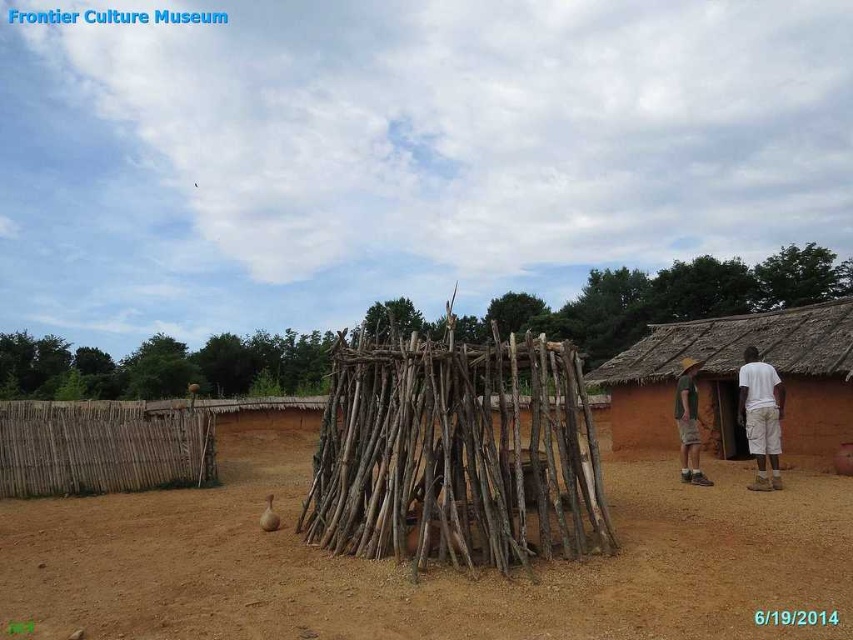
Question: Where is brown dirt field at center located in relation to brown mud hut at right in the image?

Choices:
 (A) left
 (B) right

Answer: (A)

Question: Does brown mud hut at right lie behind tan fabric shorts at lower right?

Choices:
 (A) no
 (B) yes

Answer: (A)

Question: Which point is farther from the camera taking this photo?

Choices:
 (A) (619, 438)
 (B) (769, 506)
 (C) (680, 448)
 (D) (773, 371)

Answer: (A)

Question: Which point is farther from the camera taking this photo?

Choices:
 (A) (212, 604)
 (B) (674, 404)
 (C) (824, 420)
 (D) (758, 400)

Answer: (B)

Question: Which of the following is the farthest from the observer?

Choices:
 (A) white cotton shirt at right
 (B) tan fabric shorts at lower right
 (C) brown dirt field at center

Answer: (B)

Question: Does brown dirt field at center appear on the left side of brown mud hut at right?

Choices:
 (A) yes
 (B) no

Answer: (A)